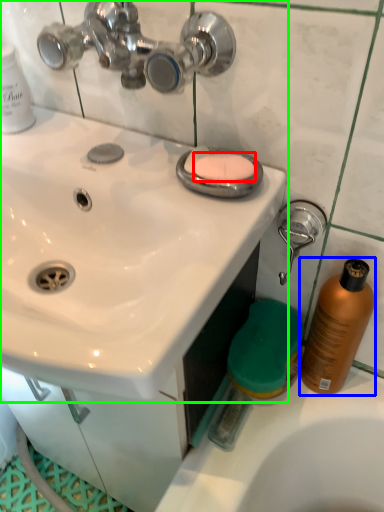
Question: Estimate the real-world distances between objects in this image. Which object is closer to soap (highlighted by a red box), cleaning product (highlighted by a blue box) or sink (highlighted by a green box)?

Choices:
 (A) cleaning product
 (B) sink

Answer: (B)